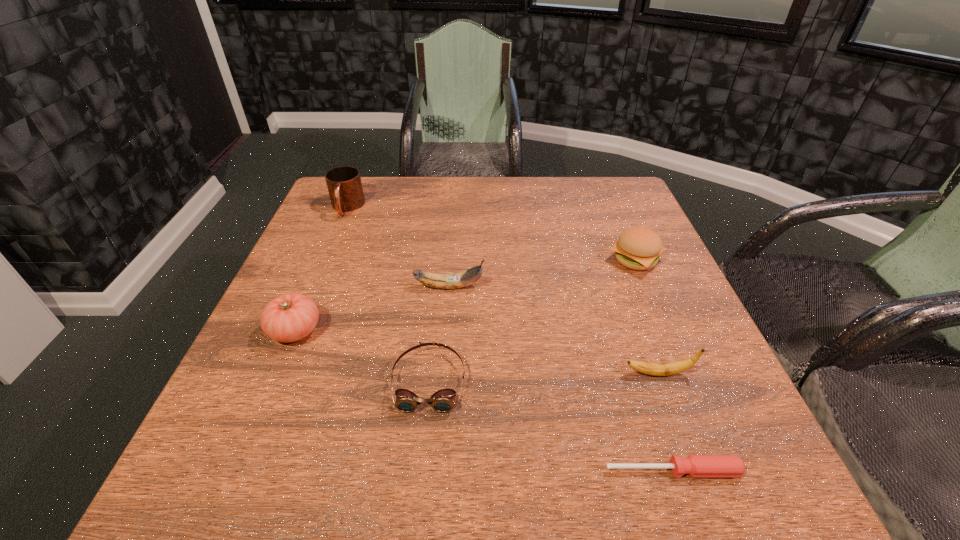
Identify the location of free space between the taller banana and the sixth nearest object. The width and height of the screenshot is (960, 540). (542, 273).

Locate an element on the screen. Image resolution: width=960 pixels, height=540 pixels. free space between the nearer banana and the third farthest object is located at coordinates (554, 330).

At what (x,y) coordinates should I click in order to perform the action: click on empty space between the tomato and the hamburger. Please return your answer as a coordinate pair (x, y). Looking at the image, I should click on (466, 295).

Select which object is the sixth closest to the hamburger. Please provide its 2D coordinates. Your answer should be formatted as a tuple, i.e. [(x, y)], where the tuple contains the x and y coordinates of a point satisfying the conditions above.

[(344, 184)]

Locate an element on the screen. Image resolution: width=960 pixels, height=540 pixels. the closest object relative to the sixth tallest object is located at coordinates (289, 317).

Find the location of a particular element. free space in the image that satisfies the following two spatial constraints: 1. on the back side of the nearest object; 2. at the stem of the farther banana is located at coordinates (612, 287).

Where is `free location that satisfies the following two spatial constraints: 1. through the lenses of the goggles; 2. on the left side of the nearest object`? free location that satisfies the following two spatial constraints: 1. through the lenses of the goggles; 2. on the left side of the nearest object is located at coordinates (420, 470).

Locate an element on the screen. free space that satisfies the following two spatial constraints: 1. at the stem of the left banana; 2. through the lenses of the goggles is located at coordinates (443, 380).

Where is `free spot that satisfies the following two spatial constraints: 1. at the stem of the nearest object; 2. on the left side of the left banana`? free spot that satisfies the following two spatial constraints: 1. at the stem of the nearest object; 2. on the left side of the left banana is located at coordinates (435, 470).

I want to click on vacant position in the image that satisfies the following two spatial constraints: 1. on the peel of the shorter banana from the top; 2. through the lenses of the goggles, so click(x=660, y=380).